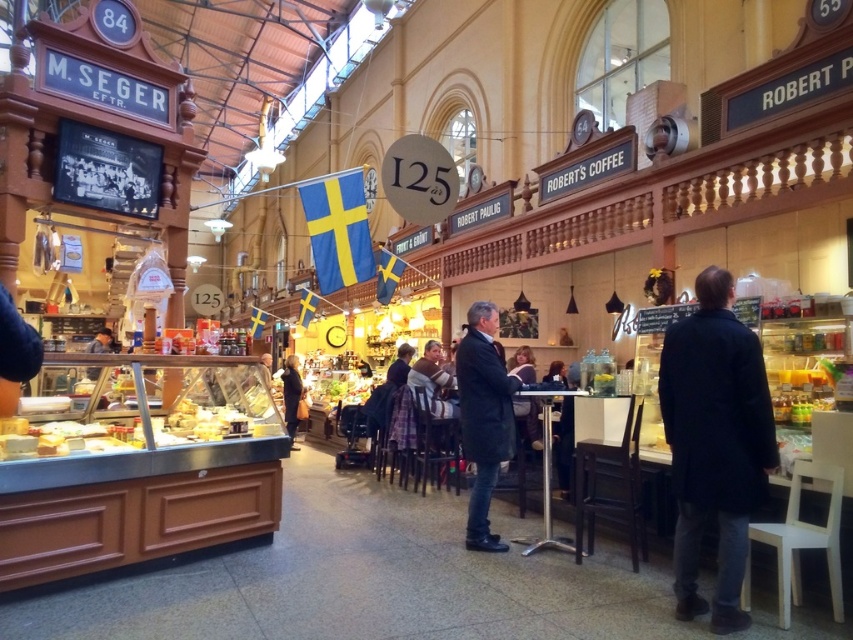
Question: Estimate the real-world distances between objects in this image. Which object is farther from the dark blue coat at center?

Choices:
 (A) dark brown leather jacket at center
 (B) dark gray coat at center

Answer: (A)

Question: Does dark blue coat at center appear over dark brown leather jacket at center?

Choices:
 (A) no
 (B) yes

Answer: (B)

Question: Estimate the real-world distances between objects in this image. Which object is closer to the dark blue coat at center?

Choices:
 (A) dark gray coat at center
 (B) dark brown leather jacket at center

Answer: (A)

Question: Does dark blue coat at center come in front of dark brown leather jacket at center?

Choices:
 (A) yes
 (B) no

Answer: (A)

Question: Can you confirm if dark blue coat at center is smaller than dark gray coat at center?

Choices:
 (A) no
 (B) yes

Answer: (A)

Question: Which point is farther from the camera taking this photo?

Choices:
 (A) [x=728, y=548]
 (B) [x=473, y=492]
 (C) [x=293, y=378]

Answer: (C)